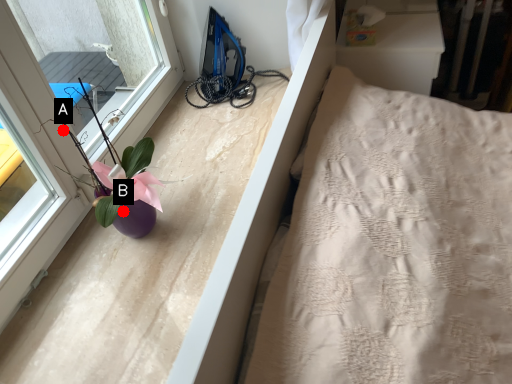
Question: Two points are circled on the image, labeled by A and B beside each circle. Which of the following is the farthest from the observer?

Choices:
 (A) A is further
 (B) B is further

Answer: (A)